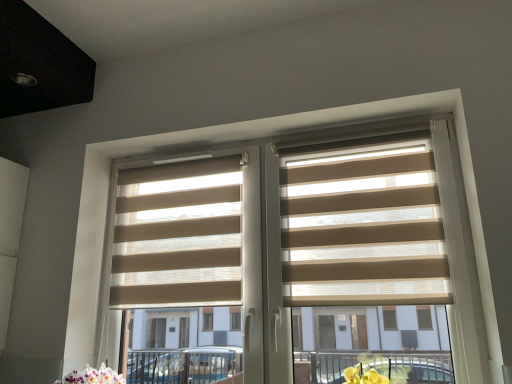
What do you see at coordinates (362, 230) in the screenshot? This screenshot has height=384, width=512. I see `beige fabric blinds at center, the second blind from the left` at bounding box center [362, 230].

What is the approximate width of beige fabric blinds at center?

It is 4.45 inches.

Locate an element on the screen. The width and height of the screenshot is (512, 384). beige fabric blinds at center, which is the 1th blind from right to left is located at coordinates (362, 230).

In the scene shown: Is beige fabric blinds at center, arranged as the 2th blind when viewed from the right, far away from beige fabric blinds at center?

No, there isn't a large distance between beige fabric blinds at center, arranged as the 2th blind when viewed from the right, and beige fabric blinds at center.

Which of these two, beige fabric blinds at center, arranged as the 1th blind when viewed from the left, or beige fabric blinds at center, is wider?

beige fabric blinds at center.

Is beige fabric blinds at center, arranged as the 1th blind when viewed from the left, facing towards beige fabric blinds at center?

Yes.

From the image's perspective, who appears lower, beige fabric blinds at center or beige fabric blinds at center, arranged as the 2th blind when viewed from the right?

beige fabric blinds at center.

Considering the sizes of objects beige fabric blinds at center and beige fabric blinds at center, arranged as the 1th blind when viewed from the left, in the image provided, who is bigger, beige fabric blinds at center or beige fabric blinds at center, arranged as the 1th blind when viewed from the left,?

Bigger between the two is beige fabric blinds at center.

Considering the positions of point (110, 235) and point (190, 257), is point (110, 235) closer or farther from the camera than point (190, 257)?

Point (110, 235) appears to be farther away from the viewer than point (190, 257).

Is beige fabric blinds at center located outside beige fabric blinds at center, arranged as the 2th blind when viewed from the right?

Yes.

Would you say beige fabric blinds at center, the second blind from the left, contains beige fabric blinds at center?

Actually, beige fabric blinds at center is outside beige fabric blinds at center, the second blind from the left.

Is beige fabric blinds at center, the second blind from the left, far away from beige fabric blinds at center?

No, beige fabric blinds at center, the second blind from the left, is not far from beige fabric blinds at center.

Considering the sizes of objects beige fabric blinds at center, the second blind from the left, and beige fabric blinds at center in the image provided, who is bigger, beige fabric blinds at center, the second blind from the left, or beige fabric blinds at center?

beige fabric blinds at center.

Is beige fabric blinds at center, which is the 1th blind from right to left, aimed at beige fabric blinds at center?

Yes, beige fabric blinds at center, which is the 1th blind from right to left, is aimed at beige fabric blinds at center.

Is beige fabric blinds at center, arranged as the 1th blind when viewed from the left, shorter than beige fabric blinds at center, which is the 1th blind from right to left?

Correct, beige fabric blinds at center, arranged as the 1th blind when viewed from the left, is not as tall as beige fabric blinds at center, which is the 1th blind from right to left.

Between beige fabric blinds at center, arranged as the 1th blind when viewed from the left, and beige fabric blinds at center, which is the 1th blind from right to left, which one has smaller width?

With smaller width is beige fabric blinds at center, which is the 1th blind from right to left.

Is beige fabric blinds at center, arranged as the 2th blind when viewed from the right, positioned with its back to beige fabric blinds at center, the second blind from the left?

beige fabric blinds at center, arranged as the 2th blind when viewed from the right, is not turned away from beige fabric blinds at center, the second blind from the left.

Which is more to the right, beige fabric blinds at center, arranged as the 1th blind when viewed from the left, or beige fabric blinds at center, which is the 1th blind from right to left?

From the viewer's perspective, beige fabric blinds at center, which is the 1th blind from right to left, appears more on the right side.

Is beige fabric blinds at center, which is the 1th blind from right to left, in front of or behind beige fabric blinds at center, arranged as the 2th blind when viewed from the right, in the image?

beige fabric blinds at center, which is the 1th blind from right to left, is positioned closer to the viewer than beige fabric blinds at center, arranged as the 2th blind when viewed from the right.

Is beige fabric blinds at center, which is the 1th blind from right to left, facing towards beige fabric blinds at center, arranged as the 2th blind when viewed from the right?

No, beige fabric blinds at center, which is the 1th blind from right to left, does not turn towards beige fabric blinds at center, arranged as the 2th blind when viewed from the right.

Considering the relative sizes of beige fabric blinds at center, which is the 1th blind from right to left, and beige fabric blinds at center, arranged as the 1th blind when viewed from the left, in the image provided, is beige fabric blinds at center, which is the 1th blind from right to left, shorter than beige fabric blinds at center, arranged as the 1th blind when viewed from the left,?

No.

Which is in front, beige fabric blinds at center or beige fabric blinds at center, the second blind from the left?

beige fabric blinds at center is in front.

Is beige fabric blinds at center, the second blind from the left, inside beige fabric blinds at center?

Yes.

Which object is positioned more to the left, beige fabric blinds at center or beige fabric blinds at center, which is the 1th blind from right to left?

From the viewer's perspective, beige fabric blinds at center appears more on the left side.

Considering the sizes of objects beige fabric blinds at center and beige fabric blinds at center, the second blind from the left, in the image provided, who is smaller, beige fabric blinds at center or beige fabric blinds at center, the second blind from the left,?

beige fabric blinds at center, the second blind from the left, is smaller.

Locate an element on the screen. Image resolution: width=512 pixels, height=384 pixels. blind on the left of beige fabric blinds at center is located at coordinates (178, 235).

In order to click on window that is under the beige fabric blinds at center, arranged as the 1th blind when viewed from the left (from a real-world perspective) in this screenshot , I will do `click(224, 142)`.

Based on their spatial positions, is beige fabric blinds at center or beige fabric blinds at center, arranged as the 2th blind when viewed from the right, closer to beige fabric blinds at center, which is the 1th blind from right to left?

beige fabric blinds at center is closer to beige fabric blinds at center, which is the 1th blind from right to left.

From the image, which object appears to be nearer to beige fabric blinds at center, which is the 1th blind from right to left, beige fabric blinds at center, arranged as the 2th blind when viewed from the right, or beige fabric blinds at center?

Among the two, beige fabric blinds at center is located nearer to beige fabric blinds at center, which is the 1th blind from right to left.

From the image, which object appears to be nearer to beige fabric blinds at center, beige fabric blinds at center, the second blind from the left, or beige fabric blinds at center, arranged as the 1th blind when viewed from the left?

Among the two, beige fabric blinds at center, arranged as the 1th blind when viewed from the left, is located nearer to beige fabric blinds at center.

Based on the photo, from the image, which object appears to be nearer to beige fabric blinds at center, arranged as the 2th blind when viewed from the right, beige fabric blinds at center, the second blind from the left, or beige fabric blinds at center?

Based on the image, beige fabric blinds at center appears to be nearer to beige fabric blinds at center, arranged as the 2th blind when viewed from the right.

Estimate the real-world distances between objects in this image. Which object is closer to beige fabric blinds at center, arranged as the 2th blind when viewed from the right, beige fabric blinds at center or beige fabric blinds at center, the second blind from the left?

beige fabric blinds at center lies closer to beige fabric blinds at center, arranged as the 2th blind when viewed from the right, than the other object.

Based on their spatial positions, is beige fabric blinds at center, arranged as the 1th blind when viewed from the left, or beige fabric blinds at center, the second blind from the left, closer to beige fabric blinds at center?

The object closer to beige fabric blinds at center is beige fabric blinds at center, arranged as the 1th blind when viewed from the left.

The width and height of the screenshot is (512, 384). I want to click on window between beige fabric blinds at center, arranged as the 2th blind when viewed from the right, and beige fabric blinds at center, the second blind from the left, from left to right, so click(x=224, y=142).